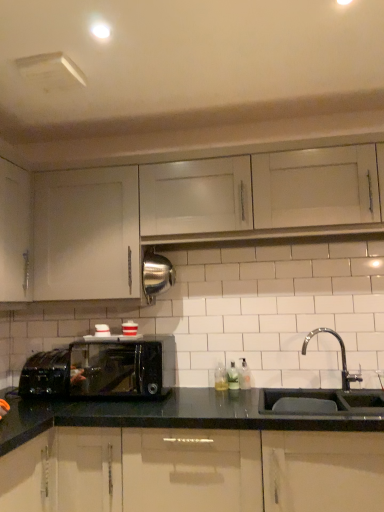
Locate an element on the screen. This screenshot has width=384, height=512. white matte cabinet at upper center, the third cabinetry ordered from the bottom is located at coordinates (261, 192).

This screenshot has height=512, width=384. Describe the element at coordinates (221, 378) in the screenshot. I see `translucent plastic soap at center, placed as the third bottle when sorted from right to left` at that location.

How much space does glossy black cabinets at lower center, positioned as the 3th cabinetry in top-to-bottom order, occupy horizontally?

glossy black cabinets at lower center, positioned as the 3th cabinetry in top-to-bottom order, is 65.02 centimeters in width.

How much space does clear glass soap dispenser at sink right, which is counted as the third bottle, starting from the left, occupy vertically?

6.33 inches.

Image resolution: width=384 pixels, height=512 pixels. Identify the location of white matte cabinet at upper center, arranged as the 1th cabinetry when viewed from the top. (261, 192).

Who is shorter, glossy black cabinets at lower center, arranged as the 1th cabinetry when ordered from the bottom, or black glossy microwave oven at lower left?

With less height is black glossy microwave oven at lower left.

From a real-world perspective, is glossy black cabinets at lower center, positioned as the 3th cabinetry in top-to-bottom order, located higher than black glossy microwave oven at lower left?

No, from a real-world perspective, glossy black cabinets at lower center, positioned as the 3th cabinetry in top-to-bottom order, is not over black glossy microwave oven at lower left

Which of these two, glossy black cabinets at lower center, arranged as the 1th cabinetry when ordered from the bottom, or black glossy microwave oven at lower left, is thinner?

black glossy microwave oven at lower left is thinner.

Is glossy black cabinets at lower center, positioned as the 3th cabinetry in top-to-bottom order, looking in the opposite direction of white matte cabinet at upper left, which appears as the 2th cabinetry when viewed from the top?

glossy black cabinets at lower center, positioned as the 3th cabinetry in top-to-bottom order, does not have its back to white matte cabinet at upper left, which appears as the 2th cabinetry when viewed from the top.

Where is `the 1st cabinetry to the right of the white matte cabinet at upper left, which appears as the 2th cabinetry when ordered from the bottom, counting from the anchor's position`? the 1st cabinetry to the right of the white matte cabinet at upper left, which appears as the 2th cabinetry when ordered from the bottom, counting from the anchor's position is located at coordinates (194, 471).

Which point is more distant from viewer, (310, 504) or (77, 226)?

Positioned behind is point (77, 226).

From the picture: Are glossy black cabinets at lower center, positioned as the 3th cabinetry in top-to-bottom order, and white matte cabinet at upper left, which appears as the 2th cabinetry when viewed from the top, far apart?

glossy black cabinets at lower center, positioned as the 3th cabinetry in top-to-bottom order, is near white matte cabinet at upper left, which appears as the 2th cabinetry when viewed from the top, not far away.

Can translucent plastic soap dispenser at center, the 2th bottle in the left-to-right sequence, be found inside black glossy microwave oven at lower left?

No, translucent plastic soap dispenser at center, the 2th bottle in the left-to-right sequence, is not inside black glossy microwave oven at lower left.

Is black glossy microwave oven at lower left positioned with its back to translucent plastic soap dispenser at center, the 2th bottle in the left-to-right sequence?

That's not correct — black glossy microwave oven at lower left is not looking away from translucent plastic soap dispenser at center, the 2th bottle in the left-to-right sequence.

Which of these two, black glossy microwave oven at lower left or translucent plastic soap dispenser at center, the 2th bottle in the left-to-right sequence, stands shorter?

With less height is translucent plastic soap dispenser at center, the 2th bottle in the left-to-right sequence.

Looking at this image, which object is thinner, black glossy microwave oven at lower left or translucent plastic soap dispenser at center, the 2th bottle in the left-to-right sequence?

translucent plastic soap dispenser at center, the 2th bottle in the left-to-right sequence, is thinner.

Does point (85, 429) come closer to viewer compared to point (207, 191)?

Yes, point (85, 429) is in front of point (207, 191).

Considering the relative sizes of glossy black cabinets at lower center, arranged as the 1th cabinetry when ordered from the bottom, and white matte cabinet at upper center, the third cabinetry ordered from the bottom, in the image provided, is glossy black cabinets at lower center, arranged as the 1th cabinetry when ordered from the bottom, taller than white matte cabinet at upper center, the third cabinetry ordered from the bottom,?

Yes, glossy black cabinets at lower center, arranged as the 1th cabinetry when ordered from the bottom, is taller than white matte cabinet at upper center, the third cabinetry ordered from the bottom.

Locate an element on the screen. The image size is (384, 512). the 2nd cabinetry located beneath the white matte cabinet at upper center, the third cabinetry ordered from the bottom (from a real-world perspective) is located at coordinates (194, 471).

Which object is thinner, glossy black cabinets at lower center, arranged as the 1th cabinetry when ordered from the bottom, or white matte cabinet at upper center, the third cabinetry ordered from the bottom?

white matte cabinet at upper center, the third cabinetry ordered from the bottom.

Considering their positions, is white matte cabinet at upper left, which appears as the 2th cabinetry when viewed from the top, located in front of or behind white matte cabinet at upper center, the third cabinetry ordered from the bottom?

white matte cabinet at upper left, which appears as the 2th cabinetry when viewed from the top, is behind white matte cabinet at upper center, the third cabinetry ordered from the bottom.

From the image's perspective, which one is positioned lower, white matte cabinet at upper left, which appears as the 2th cabinetry when ordered from the bottom, or white matte cabinet at upper center, arranged as the 1th cabinetry when viewed from the top?

white matte cabinet at upper left, which appears as the 2th cabinetry when ordered from the bottom, appears lower in the image.

Considering the sizes of objects white matte cabinet at upper left, which appears as the 2th cabinetry when viewed from the top, and white matte cabinet at upper center, the third cabinetry ordered from the bottom, in the image provided, who is wider, white matte cabinet at upper left, which appears as the 2th cabinetry when viewed from the top, or white matte cabinet at upper center, the third cabinetry ordered from the bottom,?

white matte cabinet at upper left, which appears as the 2th cabinetry when viewed from the top.

Does point (219, 384) appear closer or farther from the camera than point (381, 462)?

Clearly, point (219, 384) is more distant from the camera than point (381, 462).

From a real-world perspective, who is located lower, translucent plastic soap at center, which is the 1th bottle in left-to-right order, or glossy black cabinets at lower center, arranged as the 1th cabinetry when ordered from the bottom?

From a 3D spatial view, glossy black cabinets at lower center, arranged as the 1th cabinetry when ordered from the bottom, is below.

From the image's perspective, which is above, translucent plastic soap at center, placed as the third bottle when sorted from right to left, or glossy black cabinets at lower center, arranged as the 1th cabinetry when ordered from the bottom?

translucent plastic soap at center, placed as the third bottle when sorted from right to left.

Can you confirm if black glossy microwave oven at lower left is smaller than white matte cabinet at upper left, which appears as the 2th cabinetry when ordered from the bottom?

Indeed, black glossy microwave oven at lower left has a smaller size compared to white matte cabinet at upper left, which appears as the 2th cabinetry when ordered from the bottom.

Considering the relative sizes of black glossy microwave oven at lower left and white matte cabinet at upper left, which appears as the 2th cabinetry when ordered from the bottom, in the image provided, is black glossy microwave oven at lower left wider than white matte cabinet at upper left, which appears as the 2th cabinetry when ordered from the bottom,?

Indeed, black glossy microwave oven at lower left has a greater width compared to white matte cabinet at upper left, which appears as the 2th cabinetry when ordered from the bottom.

Is black glossy microwave oven at lower left positioned with its back to white matte cabinet at upper left, which appears as the 2th cabinetry when ordered from the bottom?

No, black glossy microwave oven at lower left is not facing away from white matte cabinet at upper left, which appears as the 2th cabinetry when ordered from the bottom.

Locate an element on the screen. microwave oven behind the glossy black cabinets at lower center, positioned as the 3th cabinetry in top-to-bottom order is located at coordinates (102, 369).

Find the location of a particular element. cabinetry below the white matte cabinet at upper left, which appears as the 2th cabinetry when ordered from the bottom (from a real-world perspective) is located at coordinates (194, 471).

Looking at the image, which one is located closer to white matte cabinet at upper left, which appears as the 2th cabinetry when viewed from the top, black glossy microwave oven at lower left or white matte cabinet at upper center, arranged as the 1th cabinetry when viewed from the top?

white matte cabinet at upper center, arranged as the 1th cabinetry when viewed from the top, lies closer to white matte cabinet at upper left, which appears as the 2th cabinetry when viewed from the top, than the other object.

From the image, which object appears to be nearer to black glossy microwave oven at lower left, glossy black cabinets at lower center, arranged as the 1th cabinetry when ordered from the bottom, or white matte cabinet at upper left, which appears as the 2th cabinetry when ordered from the bottom?

Among the two, white matte cabinet at upper left, which appears as the 2th cabinetry when ordered from the bottom, is located nearer to black glossy microwave oven at lower left.

When comparing their distances from glossy black cabinets at lower center, positioned as the 3th cabinetry in top-to-bottom order, does white matte cabinet at upper left, which appears as the 2th cabinetry when ordered from the bottom, or black matte sink at lower right seem further?

Among the two, white matte cabinet at upper left, which appears as the 2th cabinetry when ordered from the bottom, is located further to glossy black cabinets at lower center, positioned as the 3th cabinetry in top-to-bottom order.

From the image, which object appears to be nearer to glossy black cabinets at lower center, positioned as the 3th cabinetry in top-to-bottom order, white matte cabinet at upper left, which appears as the 2th cabinetry when viewed from the top, or black glossy microwave oven at lower left?

black glossy microwave oven at lower left.

In the scene shown: When comparing their distances from translucent plastic soap dispenser at center, the second bottle when ordered from right to left, does clear glass soap dispenser at sink right, which is counted as the first bottle, starting from the right, or glossy black cabinets at lower center, positioned as the 3th cabinetry in top-to-bottom order, seem further?

Among the two, glossy black cabinets at lower center, positioned as the 3th cabinetry in top-to-bottom order, is located further to translucent plastic soap dispenser at center, the second bottle when ordered from right to left.

Which object lies further to the anchor point translucent plastic soap dispenser at center, the 2th bottle in the left-to-right sequence, black matte sink at lower right or white matte cabinet at upper left, which appears as the 2th cabinetry when viewed from the top?

white matte cabinet at upper left, which appears as the 2th cabinetry when viewed from the top.

When comparing their distances from black glossy microwave oven at lower left, does translucent plastic soap dispenser at center, the 2th bottle in the left-to-right sequence, or translucent plastic soap at center, placed as the third bottle when sorted from right to left, seem closer?

Among the two, translucent plastic soap at center, placed as the third bottle when sorted from right to left, is located nearer to black glossy microwave oven at lower left.

Considering their positions, is translucent plastic soap dispenser at center, the 2th bottle in the left-to-right sequence, positioned further to glossy black cabinets at lower center, arranged as the 1th cabinetry when ordered from the bottom, than black glossy microwave oven at lower left?

translucent plastic soap dispenser at center, the 2th bottle in the left-to-right sequence, is positioned further to the anchor glossy black cabinets at lower center, arranged as the 1th cabinetry when ordered from the bottom.

Find the location of a particular element. The height and width of the screenshot is (512, 384). microwave oven positioned between glossy black cabinets at lower center, positioned as the 3th cabinetry in top-to-bottom order, and translucent plastic soap dispenser at center, the second bottle when ordered from right to left, from near to far is located at coordinates (102, 369).

Image resolution: width=384 pixels, height=512 pixels. I want to click on sink between white matte cabinet at upper center, arranged as the 1th cabinetry when viewed from the top, and translucent plastic soap at center, which is the 1th bottle in left-to-right order, from top to bottom, so click(x=324, y=394).

Where is `sink between glossy black cabinets at lower center, positioned as the 3th cabinetry in top-to-bottom order, and clear glass soap dispenser at sink right, which is counted as the third bottle, starting from the left, along the z-axis`? The image size is (384, 512). sink between glossy black cabinets at lower center, positioned as the 3th cabinetry in top-to-bottom order, and clear glass soap dispenser at sink right, which is counted as the third bottle, starting from the left, along the z-axis is located at coordinates (324, 394).

The width and height of the screenshot is (384, 512). I want to click on bottle between translucent plastic soap at center, which is the 1th bottle in left-to-right order, and clear glass soap dispenser at sink right, which is counted as the third bottle, starting from the left, so click(233, 377).